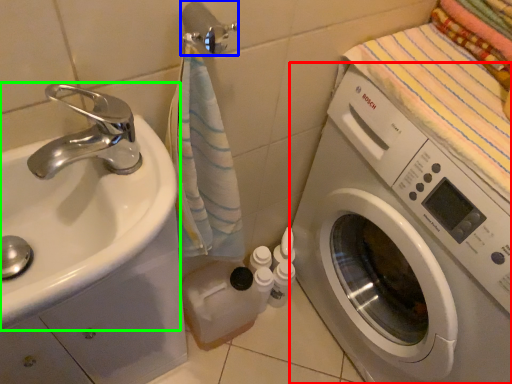
Question: Which object is positioned farthest from washing machine (highlighted by a red box)? Select from towel bar (highlighted by a blue box) and sink (highlighted by a green box).

Choices:
 (A) towel bar
 (B) sink

Answer: (A)